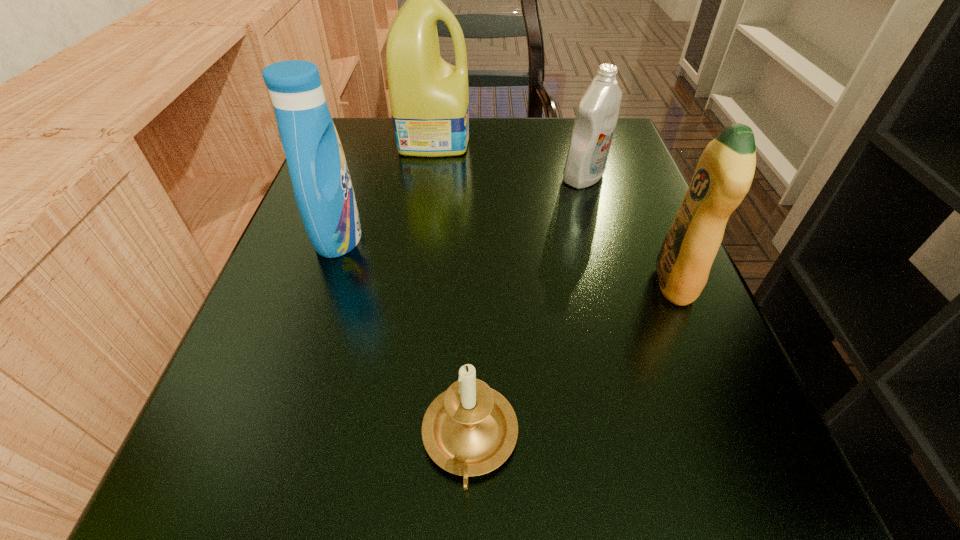
At what (x,y) coordinates should I click in order to perform the action: click on vacant space at the right edge of the desktop. Please return your answer as a coordinate pair (x, y). Looking at the image, I should click on (610, 392).

Find the location of `vacant space at the far left corner`. vacant space at the far left corner is located at coordinates (396, 162).

Find the location of `vacant position at the far right corner of the desktop`. vacant position at the far right corner of the desktop is located at coordinates (561, 154).

Find the location of a particular element. free space between the rightmost detergent and the shortest detergent is located at coordinates (629, 230).

Locate an element on the screen. empty location between the leftmost detergent and the candle holder is located at coordinates tap(404, 339).

At what (x,y) coordinates should I click in order to perform the action: click on vacant space that's between the rightmost detergent and the third detergent from right to left. Please return your answer as a coordinate pair (x, y). The image size is (960, 540). Looking at the image, I should click on (554, 211).

This screenshot has height=540, width=960. I want to click on vacant space that is in between the fourth tallest object and the third detergent from right to left, so click(509, 158).

This screenshot has height=540, width=960. I want to click on vacant space that is in between the leftmost detergent and the second farthest object, so click(x=461, y=207).

In order to click on vacant region between the fourth tallest object and the candle holder in this screenshot , I will do `click(527, 309)`.

You are a GUI agent. You are given a task and a screenshot of the screen. Output one action in this format:
    pyautogui.click(x=<x>, y=<y>)
    Task: Click on the unoccupied area between the second farthest detergent and the farthest object
    The width and height of the screenshot is (960, 540).
    Given the screenshot: What is the action you would take?
    pyautogui.click(x=509, y=158)